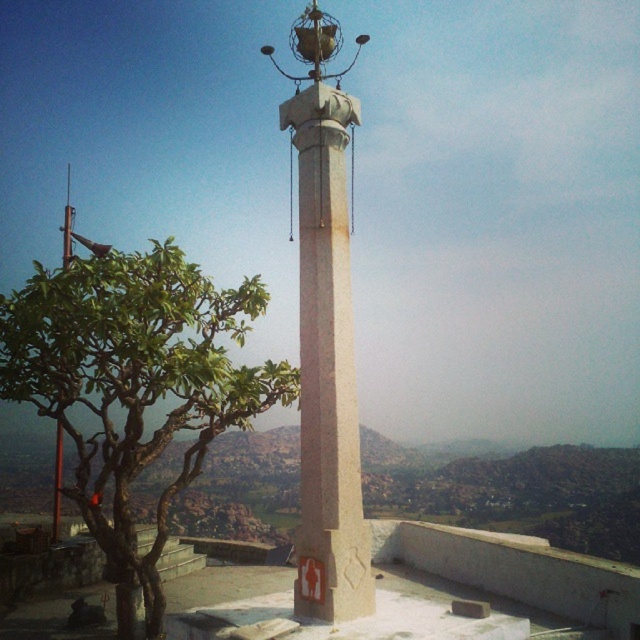
You are a landscape architect designing a garden path that needs to pass between the green leafy tree at left and the white stone column at center. Based on their positions, which direction should the path curve to avoid the tree and column?

The green leafy tree at left is below the white stone column at center, so the path should curve upwards to avoid the tree and column.

You are standing at a point 34.37 feet away from the point marked at coordinates (70, 328) in the image. Given this distance, can you estimate how far you are from the tall stone pillar in the scene?

The point marked at coordinates (70, 328) is 34.37 feet away from you. Since the tall stone pillar is the most prominent object in the foreground, it is likely located near this point. Therefore, you are approximately 34.37 feet away from the tall stone pillar.

You are standing at the center of the image and want to locate the green leafy tree at left. Which direction should you look to find it?

You should look to the left to find the green leafy tree at left since it is positioned at the left side of the image.